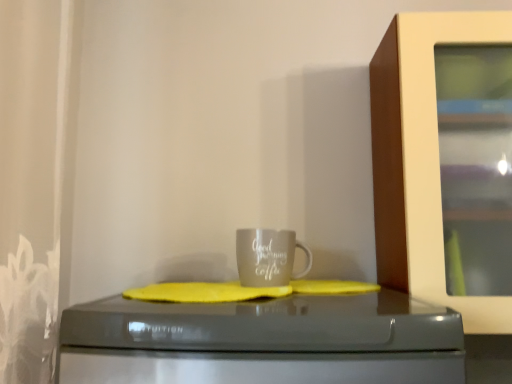
What are the coordinates of `white glossy mug at center` in the screenshot? It's located at (268, 257).

This screenshot has width=512, height=384. Describe the element at coordinates (268, 257) in the screenshot. I see `white glossy mug at center` at that location.

Measure the distance between point (311, 266) and camera.

3.97 feet.

Identify the location of white glossy mug at center. This screenshot has width=512, height=384. (268, 257).